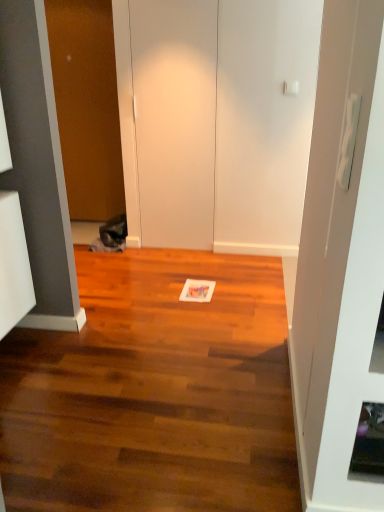
This screenshot has height=512, width=384. In order to click on blank area beneath white matte door at center, marked as the 1th door in a right-to-left arrangement (from a real-world perspective) in this screenshot , I will do `click(178, 248)`.